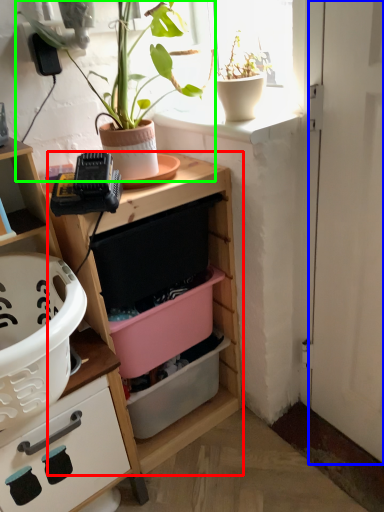
Question: Estimate the real-world distances between objects in this image. Which object is closer to shelf (highlighted by a red box), door (highlighted by a blue box) or houseplant (highlighted by a green box)?

Choices:
 (A) door
 (B) houseplant

Answer: (A)